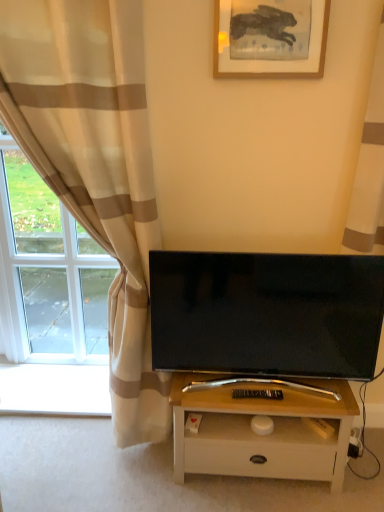
Where is `vacant area to the right of black plastic remote control at center`? The height and width of the screenshot is (512, 384). vacant area to the right of black plastic remote control at center is located at coordinates (293, 396).